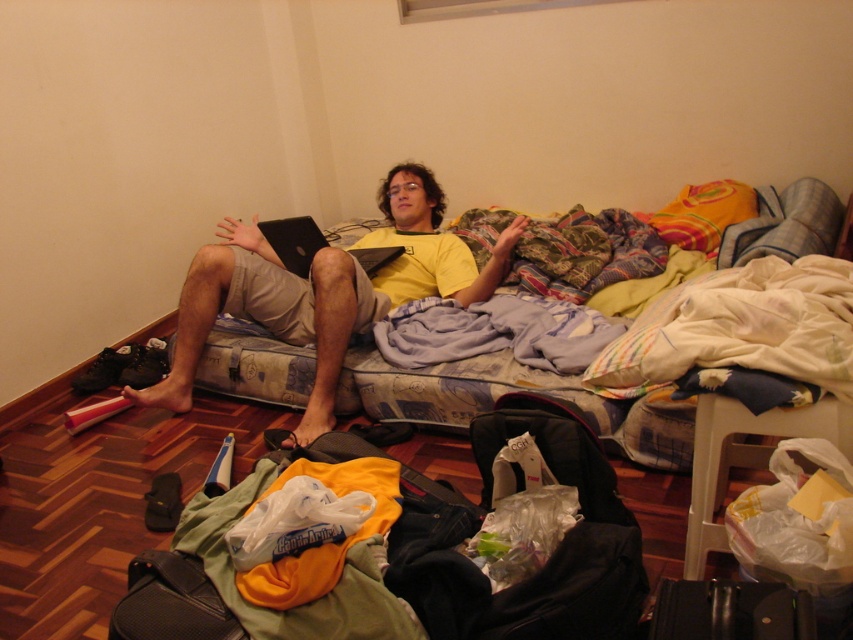
Is yellow matte/yellow t-shirt at center above black textured bag at lower left?

Indeed, yellow matte/yellow t-shirt at center is positioned over black textured bag at lower left.

Who is more distant from viewer, (218, 304) or (187, 621)?

Point (218, 304)

Locate an element on the screen. This screenshot has width=853, height=640. yellow matte/yellow t-shirt at center is located at coordinates (323, 291).

Does yellow matte/yellow t-shirt at center appear over black leather suitcase at lower right?

Indeed, yellow matte/yellow t-shirt at center is positioned over black leather suitcase at lower right.

Does yellow matte/yellow t-shirt at center have a larger size compared to black leather suitcase at lower right?

Indeed, yellow matte/yellow t-shirt at center has a larger size compared to black leather suitcase at lower right.

Does point (299, 298) lie behind point (808, 632)?

Yes, it is.

Where is `yellow matte/yellow t-shirt at center`? This screenshot has width=853, height=640. yellow matte/yellow t-shirt at center is located at coordinates (323, 291).

Between black leather suitcase at lower right and black textured bag at lower left, which one has more height?

black textured bag at lower left

Does point (680, 612) lie behind point (201, 604)?

No, (680, 612) is in front of (201, 604).

This screenshot has width=853, height=640. I want to click on black leather suitcase at lower right, so (x=730, y=611).